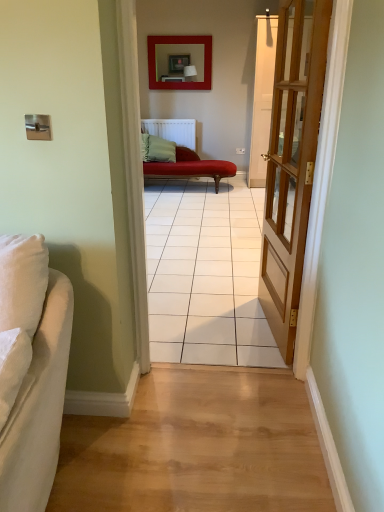
Image resolution: width=384 pixels, height=512 pixels. Identify the location of vacant area in front of light brown wooden door at right. (254, 371).